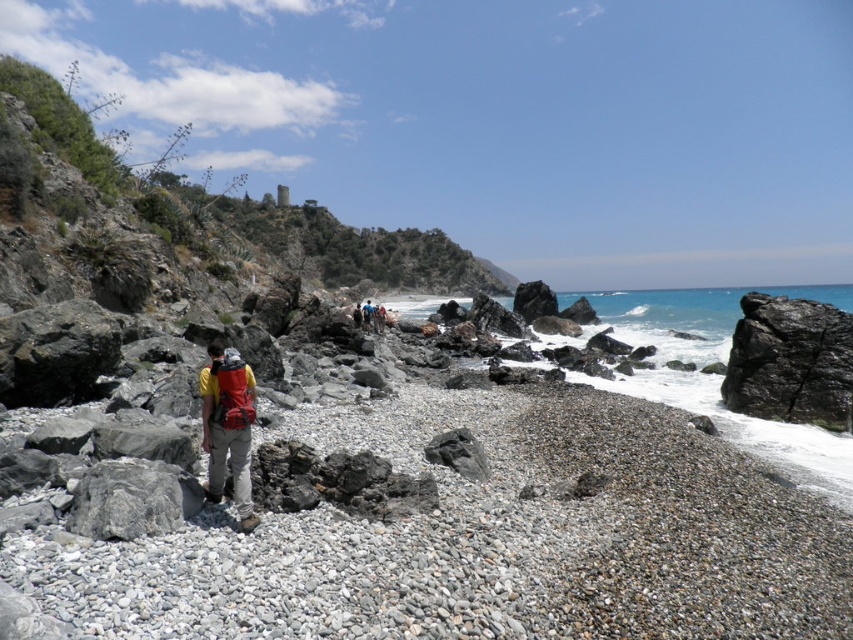
Can you confirm if gray rough rock at lower left is bigger than matte red backpack at center?

Actually, gray rough rock at lower left might be smaller than matte red backpack at center.

At what (x,y) coordinates should I click in order to perform the action: click on gray rough rock at lower left. Please return your answer as a coordinate pair (x, y). Looking at the image, I should click on (132, 499).

Can you confirm if black rough rock at right is positioned to the right of matte red backpack at center?

Indeed, black rough rock at right is positioned on the right side of matte red backpack at center.

Can you confirm if black rough rock at right is shorter than matte red backpack at center?

No, black rough rock at right is not shorter than matte red backpack at center.

Locate an element on the screen. This screenshot has width=853, height=640. black rough rock at right is located at coordinates (790, 362).

Which is below, black rough rock at right or gray rough rock at lower left?

gray rough rock at lower left is below.

The image size is (853, 640). What do you see at coordinates (790, 362) in the screenshot?
I see `black rough rock at right` at bounding box center [790, 362].

The image size is (853, 640). Identify the location of black rough rock at right. (790, 362).